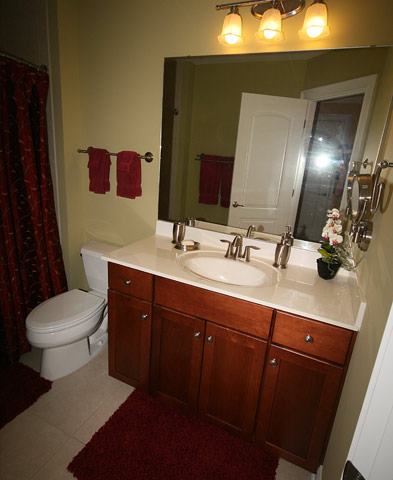
You are a GUI agent. You are given a task and a screenshot of the screen. Output one action in this format:
    pyautogui.click(x=<x>, y=<y>)
    Task: Click on the cabinet door
    The height and width of the screenshot is (480, 393).
    Given the screenshot: What is the action you would take?
    pyautogui.click(x=182, y=332)